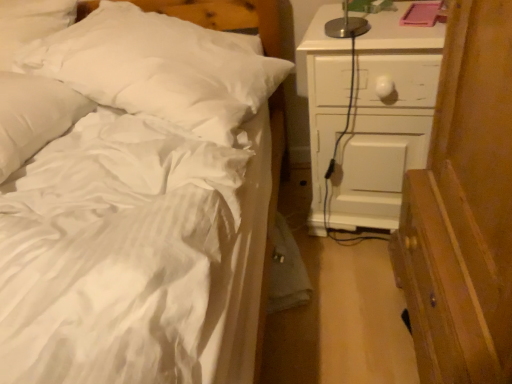
The height and width of the screenshot is (384, 512). Find the location of `white soft pillow at upper left, acting as the second pillow starting from the left`. white soft pillow at upper left, acting as the second pillow starting from the left is located at coordinates (160, 68).

Measure the distance between white painted wood chest of drawers at right and camera.

white painted wood chest of drawers at right is 3.29 feet away from camera.

Find the location of a particular element. This screenshot has height=384, width=512. white soft pillow at upper left, acting as the second pillow starting from the left is located at coordinates (160, 68).

Is white soft pillow at upper left, acting as the second pillow starting from the left, placed right next to white painted wood chest of drawers at right?

No, white soft pillow at upper left, acting as the second pillow starting from the left, is not beside white painted wood chest of drawers at right.

Considering the relative sizes of white soft pillow at upper left, the first pillow viewed from the right, and white painted wood chest of drawers at right in the image provided, is white soft pillow at upper left, the first pillow viewed from the right, shorter than white painted wood chest of drawers at right?

Correct, white soft pillow at upper left, the first pillow viewed from the right, is not as tall as white painted wood chest of drawers at right.

Is white soft pillow at upper left, the first pillow viewed from the right, not inside white painted wood chest of drawers at right?

Yes, white soft pillow at upper left, the first pillow viewed from the right, is located beyond the bounds of white painted wood chest of drawers at right.

Between white soft pillow at upper left, marked as the 1th pillow in a left-to-right arrangement, and white soft pillow at upper left, acting as the second pillow starting from the left, which one is positioned behind?

white soft pillow at upper left, acting as the second pillow starting from the left, is further away from the camera.

Can you tell me how much white soft pillow at upper left, which is counted as the second pillow, starting from the right, and white soft pillow at upper left, acting as the second pillow starting from the left, differ in facing direction?

8.74 degrees.

Based on the photo, between white soft pillow at upper left, marked as the 1th pillow in a left-to-right arrangement, and white soft pillow at upper left, acting as the second pillow starting from the left, which one appears on the left side from the viewer's perspective?

From the viewer's perspective, white soft pillow at upper left, marked as the 1th pillow in a left-to-right arrangement, appears more on the left side.

From a real-world perspective, is white soft pillow at upper left, marked as the 1th pillow in a left-to-right arrangement, located beneath white soft pillow at upper left, the first pillow viewed from the right?

No, from a real-world perspective, white soft pillow at upper left, marked as the 1th pillow in a left-to-right arrangement, is not beneath white soft pillow at upper left, the first pillow viewed from the right.

Based on the photo, from a real-world perspective, is white soft pillow at upper left, which is counted as the second pillow, starting from the right, positioned under white painted wood chest of drawers at right based on gravity?

Incorrect, from a real-world perspective, white soft pillow at upper left, which is counted as the second pillow, starting from the right, is higher than white painted wood chest of drawers at right.

Can you confirm if white soft pillow at upper left, marked as the 1th pillow in a left-to-right arrangement, is shorter than white painted wood chest of drawers at right?

Correct, white soft pillow at upper left, marked as the 1th pillow in a left-to-right arrangement, is not as tall as white painted wood chest of drawers at right.

Is point (20, 144) in front of point (362, 163)?

Yes.

Could you measure the distance between white soft pillow at upper left, which is counted as the second pillow, starting from the right, and white painted wood chest of drawers at right?

30.07 inches.

From a real-world perspective, is white painted wood chest of drawers at right on top of white soft pillow at upper left, marked as the 1th pillow in a left-to-right arrangement?

No, from a real-world perspective, white painted wood chest of drawers at right is not over white soft pillow at upper left, marked as the 1th pillow in a left-to-right arrangement

Considering the sizes of objects white painted wood chest of drawers at right and white soft pillow at upper left, which is counted as the second pillow, starting from the right, in the image provided, who is wider, white painted wood chest of drawers at right or white soft pillow at upper left, which is counted as the second pillow, starting from the right,?

white painted wood chest of drawers at right.

The image size is (512, 384). Identify the location of pillow below the white painted wood chest of drawers at right (from the image's perspective). (34, 116).

Is white painted wood chest of drawers at right next to white soft pillow at upper left, marked as the 1th pillow in a left-to-right arrangement?

white painted wood chest of drawers at right and white soft pillow at upper left, marked as the 1th pillow in a left-to-right arrangement, are clearly separated.

Based on their positions, is white soft pillow at upper left, acting as the second pillow starting from the left, located to the left or right of white soft pillow at upper left, which is counted as the second pillow, starting from the right?

Based on their positions, white soft pillow at upper left, acting as the second pillow starting from the left, is located to the right of white soft pillow at upper left, which is counted as the second pillow, starting from the right.

Between white soft pillow at upper left, the first pillow viewed from the right, and white soft pillow at upper left, which is counted as the second pillow, starting from the right, which one has more height?

white soft pillow at upper left, the first pillow viewed from the right, is taller.

From a real-world perspective, is white soft pillow at upper left, acting as the second pillow starting from the left, above or below white soft pillow at upper left, marked as the 1th pillow in a left-to-right arrangement?

Clearly, from a real-world perspective, white soft pillow at upper left, acting as the second pillow starting from the left, is below white soft pillow at upper left, marked as the 1th pillow in a left-to-right arrangement.

Would you consider white soft pillow at upper left, the first pillow viewed from the right, to be distant from white soft pillow at upper left, marked as the 1th pillow in a left-to-right arrangement?

That's not correct — white soft pillow at upper left, the first pillow viewed from the right, is a little close to white soft pillow at upper left, marked as the 1th pillow in a left-to-right arrangement.

Is white painted wood chest of drawers at right far away from white soft pillow at upper left, the first pillow viewed from the right?

That's not correct — white painted wood chest of drawers at right is a little close to white soft pillow at upper left, the first pillow viewed from the right.

Which of these two, white painted wood chest of drawers at right or white soft pillow at upper left, acting as the second pillow starting from the left, stands taller?

white painted wood chest of drawers at right.

Which is behind, white painted wood chest of drawers at right or white soft pillow at upper left, acting as the second pillow starting from the left?

white painted wood chest of drawers at right is more distant.

Would you say white painted wood chest of drawers at right is to the left or to the right of white soft pillow at upper left, the first pillow viewed from the right, in the picture?

In the image, white painted wood chest of drawers at right appears on the right side of white soft pillow at upper left, the first pillow viewed from the right.

Locate an element on the screen. This screenshot has height=384, width=512. chest of drawers below the white soft pillow at upper left, the first pillow viewed from the right (from a real-world perspective) is located at coordinates (386, 121).

Locate an element on the screen. Image resolution: width=512 pixels, height=384 pixels. pillow on the right of white soft pillow at upper left, which is counted as the second pillow, starting from the right is located at coordinates (160, 68).

From the image, which object appears to be nearer to white painted wood chest of drawers at right, white soft pillow at upper left, acting as the second pillow starting from the left, or white soft pillow at upper left, marked as the 1th pillow in a left-to-right arrangement?

Among the two, white soft pillow at upper left, acting as the second pillow starting from the left, is located nearer to white painted wood chest of drawers at right.

Looking at the image, which one is located closer to white soft pillow at upper left, the first pillow viewed from the right, white soft pillow at upper left, which is counted as the second pillow, starting from the right, or white painted wood chest of drawers at right?

white soft pillow at upper left, which is counted as the second pillow, starting from the right.

Estimate the real-world distances between objects in this image. Which object is further from white soft pillow at upper left, which is counted as the second pillow, starting from the right, white painted wood chest of drawers at right or white soft pillow at upper left, the first pillow viewed from the right?

Based on the image, white painted wood chest of drawers at right appears to be further to white soft pillow at upper left, which is counted as the second pillow, starting from the right.

From the image, which object appears to be nearer to white painted wood chest of drawers at right, white soft pillow at upper left, which is counted as the second pillow, starting from the right, or white soft pillow at upper left, the first pillow viewed from the right?

white soft pillow at upper left, the first pillow viewed from the right, is positioned closer to the anchor white painted wood chest of drawers at right.

When comparing their distances from white soft pillow at upper left, which is counted as the second pillow, starting from the right, does white soft pillow at upper left, acting as the second pillow starting from the left, or white painted wood chest of drawers at right seem further?

white painted wood chest of drawers at right lies further to white soft pillow at upper left, which is counted as the second pillow, starting from the right, than the other object.

Estimate the real-world distances between objects in this image. Which object is further from white soft pillow at upper left, acting as the second pillow starting from the left, white painted wood chest of drawers at right or white soft pillow at upper left, marked as the 1th pillow in a left-to-right arrangement?

The object further to white soft pillow at upper left, acting as the second pillow starting from the left, is white painted wood chest of drawers at right.

Identify the location of pillow located between white soft pillow at upper left, which is counted as the second pillow, starting from the right, and white painted wood chest of drawers at right in the left-right direction. The image size is (512, 384). (160, 68).